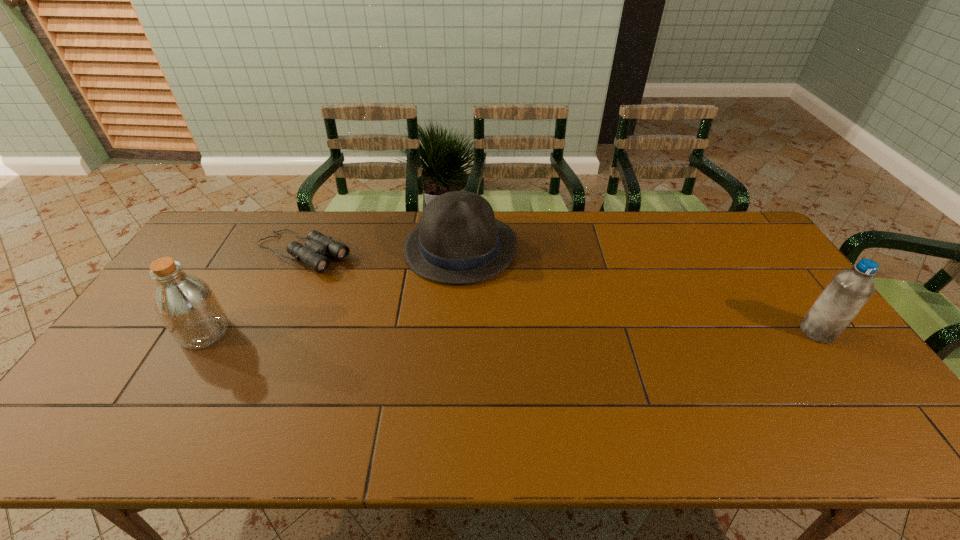
You are a GUI agent. You are given a task and a screenshot of the screen. Output one action in this format:
    pyautogui.click(x=<x>, y=<y>)
    Task: Click on the free spot on the desktop that is between the bottle and the rightmost object and is positioned on the front-facing side of the third object from left to right
    
    Given the screenshot: What is the action you would take?
    pyautogui.click(x=491, y=332)

This screenshot has width=960, height=540. What are the coordinates of `vacant space on the desktop that is between the bottle and the rightmost object and is positioned at the eyepiece of the shortest object` in the screenshot? It's located at (436, 332).